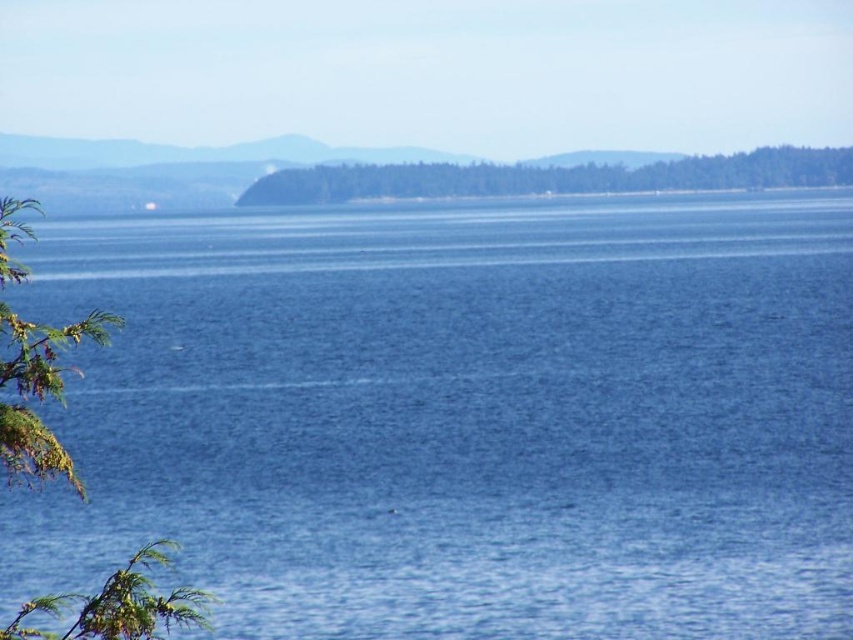
Question: Which object is positioned closest to the blue water at center?

Choices:
 (A) green leafy branch at left
 (B) green leafy tree at center

Answer: (A)

Question: Is green leafy branch at left positioned behind green leafy tree at center?

Choices:
 (A) yes
 (B) no

Answer: (B)

Question: Can you confirm if blue water at center is thinner than green leafy branch at left?

Choices:
 (A) yes
 (B) no

Answer: (B)

Question: Which is nearer to the green leafy tree at center?

Choices:
 (A) green leafy branch at left
 (B) blue water at center

Answer: (B)

Question: Can you confirm if green leafy branch at left is wider than green leafy tree at center?

Choices:
 (A) no
 (B) yes

Answer: (A)

Question: Which of the following is the farthest from the observer?

Choices:
 (A) (358, 524)
 (B) (180, 608)
 (C) (320, 184)

Answer: (C)